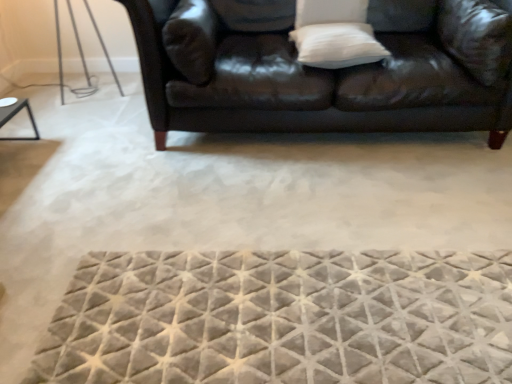
In order to face textured gray mat at center, should I rotate leftwards or rightwards?

Rotate right and turn 6.206 degrees.

Where is `white soft pillow at upper center, arranged as the first pillow when viewed from the left`? white soft pillow at upper center, arranged as the first pillow when viewed from the left is located at coordinates 337,45.

This screenshot has height=384, width=512. Find the location of `white soft pillow at upper right, marked as the 3th pillow in a left-to-right arrangement`. white soft pillow at upper right, marked as the 3th pillow in a left-to-right arrangement is located at coordinates (476, 37).

Is textured gray mat at center aimed at white soft pillow at upper center, arranged as the first pillow when viewed from the left?

No, textured gray mat at center does not turn towards white soft pillow at upper center, arranged as the first pillow when viewed from the left.

From a real-world perspective, is textured gray mat at center physically located above or below white soft pillow at upper center, which is the 3th pillow in right-to-left order?

From a real-world perspective, textured gray mat at center is physically below white soft pillow at upper center, which is the 3th pillow in right-to-left order.

This screenshot has width=512, height=384. I want to click on mat that appears on the left of white soft pillow at upper center, arranged as the first pillow when viewed from the left, so click(x=282, y=318).

Considering the relative positions of textured gray mat at center and white soft pillow at upper center, which is the 3th pillow in right-to-left order, in the image provided, is textured gray mat at center to the left of white soft pillow at upper center, which is the 3th pillow in right-to-left order, from the viewer's perspective?

Indeed, textured gray mat at center is positioned on the left side of white soft pillow at upper center, which is the 3th pillow in right-to-left order.

Who is taller, white soft pillow at upper center, arranged as the first pillow when viewed from the left, or leather couch at upper center?

leather couch at upper center is taller.

Is white soft pillow at upper center, which is the 3th pillow in right-to-left order, at the left side of leather couch at upper center?

No.

Can you tell me how much white soft pillow at upper center, arranged as the first pillow when viewed from the left, and leather couch at upper center differ in facing direction?

There is a 6.92e-05-degree angle between the facing directions of white soft pillow at upper center, arranged as the first pillow when viewed from the left, and leather couch at upper center.

From the image's perspective, is white soft pillow at upper center, arranged as the first pillow when viewed from the left, located above or below leather couch at upper center?

white soft pillow at upper center, arranged as the first pillow when viewed from the left, is situated lower than leather couch at upper center in the image.

Who is taller, white soft pillow at upper center, which is the 3th pillow in right-to-left order, or white soft pillow at upper right, the first pillow in the right-to-left sequence?

white soft pillow at upper right, the first pillow in the right-to-left sequence, is taller.

Based on their positions, is white soft pillow at upper center, arranged as the first pillow when viewed from the left, located to the left or right of white soft pillow at upper right, the first pillow in the right-to-left sequence?

In the image, white soft pillow at upper center, arranged as the first pillow when viewed from the left, appears on the left side of white soft pillow at upper right, the first pillow in the right-to-left sequence.

From the image's perspective, is white soft pillow at upper center, which is the 3th pillow in right-to-left order, on white soft pillow at upper right, marked as the 3th pillow in a left-to-right arrangement?

No, from the image's perspective, white soft pillow at upper center, which is the 3th pillow in right-to-left order, is not on top of white soft pillow at upper right, marked as the 3th pillow in a left-to-right arrangement.

Is leather couch at upper center oriented away from textured gray mat at center?

No.

Locate an element on the screen. mat in front of the leather couch at upper center is located at coordinates (282, 318).

Is leather couch at upper center touching textured gray mat at center?

No, leather couch at upper center is not with textured gray mat at center.

Based on their positions, is white soft pillow at upper center, which ranks as the 2th pillow in left-to-right order, located to the left or right of textured gray mat at center?

From the image, it's evident that white soft pillow at upper center, which ranks as the 2th pillow in left-to-right order, is to the right of textured gray mat at center.

Where is `pillow that is the 3rd object located behind the textured gray mat at center`? pillow that is the 3rd object located behind the textured gray mat at center is located at coordinates (330, 12).

Looking at this image, from a real-world perspective, who is located lower, white soft pillow at upper center, the second pillow from the right, or textured gray mat at center?

textured gray mat at center.

Can you confirm if leather couch at upper center is wider than white soft pillow at upper right, marked as the 3th pillow in a left-to-right arrangement?

Correct, the width of leather couch at upper center exceeds that of white soft pillow at upper right, marked as the 3th pillow in a left-to-right arrangement.

How different are the orientations of leather couch at upper center and white soft pillow at upper right, marked as the 3th pillow in a left-to-right arrangement, in degrees?

They differ by 90 degrees in their facing directions.

Between leather couch at upper center and white soft pillow at upper right, marked as the 3th pillow in a left-to-right arrangement, which one is positioned in front?

leather couch at upper center.

From a real-world perspective, is leather couch at upper center over white soft pillow at upper right, the first pillow in the right-to-left sequence?

Actually, leather couch at upper center is physically below white soft pillow at upper right, the first pillow in the right-to-left sequence, in the real world.

Considering the sizes of white soft pillow at upper center, which ranks as the 2th pillow in left-to-right order, and white soft pillow at upper right, marked as the 3th pillow in a left-to-right arrangement, in the image, is white soft pillow at upper center, which ranks as the 2th pillow in left-to-right order, taller or shorter than white soft pillow at upper right, marked as the 3th pillow in a left-to-right arrangement,?

In the image, white soft pillow at upper center, which ranks as the 2th pillow in left-to-right order, appears to be shorter than white soft pillow at upper right, marked as the 3th pillow in a left-to-right arrangement.

Considering the positions of points (304, 15) and (440, 2), is point (304, 15) closer to camera compared to point (440, 2)?

No, (304, 15) is behind (440, 2).

Is white soft pillow at upper center, which ranks as the 2th pillow in left-to-right order, further to camera compared to white soft pillow at upper right, marked as the 3th pillow in a left-to-right arrangement?

Yes, it is.

Is white soft pillow at upper center, the second pillow from the right, positioned beyond the bounds of white soft pillow at upper right, the first pillow in the right-to-left sequence?

Yes, white soft pillow at upper center, the second pillow from the right, is located beyond the bounds of white soft pillow at upper right, the first pillow in the right-to-left sequence.

You are a GUI agent. You are given a task and a screenshot of the screen. Output one action in this format:
    pyautogui.click(x=<x>, y=<y>)
    Task: Click on the pillow that is the 1st one above the textured gray mat at center (from a real-world perspective)
    
    Given the screenshot: What is the action you would take?
    pos(337,45)

Where is `studio couch directly beneath the white soft pillow at upper center, arranged as the first pillow when viewed from the left (from a real-world perspective)`? This screenshot has height=384, width=512. studio couch directly beneath the white soft pillow at upper center, arranged as the first pillow when viewed from the left (from a real-world perspective) is located at coordinates (306, 74).

Looking at the image, which one is located closer to white soft pillow at upper center, arranged as the first pillow when viewed from the left, white soft pillow at upper right, marked as the 3th pillow in a left-to-right arrangement, or leather couch at upper center?

leather couch at upper center is positioned closer to the anchor white soft pillow at upper center, arranged as the first pillow when viewed from the left.

Estimate the real-world distances between objects in this image. Which object is closer to leather couch at upper center, white soft pillow at upper center, which is the 3th pillow in right-to-left order, or textured gray mat at center?

white soft pillow at upper center, which is the 3th pillow in right-to-left order, is positioned closer to the anchor leather couch at upper center.

Consider the image. Based on their spatial positions, is white soft pillow at upper right, marked as the 3th pillow in a left-to-right arrangement, or textured gray mat at center closer to white soft pillow at upper center, arranged as the first pillow when viewed from the left?

white soft pillow at upper right, marked as the 3th pillow in a left-to-right arrangement, is positioned closer to the anchor white soft pillow at upper center, arranged as the first pillow when viewed from the left.

Which object lies further to the anchor point white soft pillow at upper center, which is the 3th pillow in right-to-left order, leather couch at upper center or textured gray mat at center?

Among the two, textured gray mat at center is located further to white soft pillow at upper center, which is the 3th pillow in right-to-left order.

Based on their spatial positions, is textured gray mat at center or white soft pillow at upper center, which ranks as the 2th pillow in left-to-right order, further from white soft pillow at upper center, arranged as the first pillow when viewed from the left?

Based on the image, textured gray mat at center appears to be further to white soft pillow at upper center, arranged as the first pillow when viewed from the left.

Looking at the image, which one is located closer to white soft pillow at upper center, which ranks as the 2th pillow in left-to-right order, textured gray mat at center or white soft pillow at upper right, the first pillow in the right-to-left sequence?

Based on the image, white soft pillow at upper right, the first pillow in the right-to-left sequence, appears to be nearer to white soft pillow at upper center, which ranks as the 2th pillow in left-to-right order.

Considering their positions, is leather couch at upper center positioned further to textured gray mat at center than white soft pillow at upper right, the first pillow in the right-to-left sequence?

white soft pillow at upper right, the first pillow in the right-to-left sequence, is positioned further to the anchor textured gray mat at center.

When comparing their distances from white soft pillow at upper center, which ranks as the 2th pillow in left-to-right order, does white soft pillow at upper right, marked as the 3th pillow in a left-to-right arrangement, or white soft pillow at upper center, which is the 3th pillow in right-to-left order, seem further?

Based on the image, white soft pillow at upper right, marked as the 3th pillow in a left-to-right arrangement, appears to be further to white soft pillow at upper center, which ranks as the 2th pillow in left-to-right order.

At what (x,y) coordinates should I click in order to perform the action: click on studio couch that lies between white soft pillow at upper center, which ranks as the 2th pillow in left-to-right order, and textured gray mat at center from top to bottom. Please return your answer as a coordinate pair (x, y). This screenshot has width=512, height=384. Looking at the image, I should click on (306, 74).

This screenshot has width=512, height=384. I want to click on pillow between white soft pillow at upper right, the first pillow in the right-to-left sequence, and textured gray mat at center, in the vertical direction, so click(337, 45).

Locate an element on the screen. The height and width of the screenshot is (384, 512). pillow between white soft pillow at upper center, arranged as the first pillow when viewed from the left, and white soft pillow at upper right, the first pillow in the right-to-left sequence, from left to right is located at coordinates (330, 12).